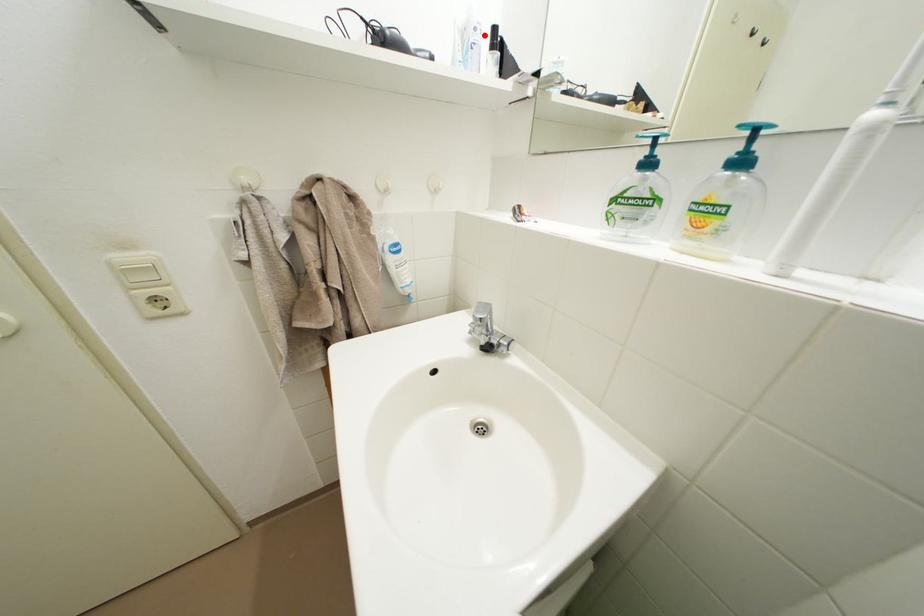
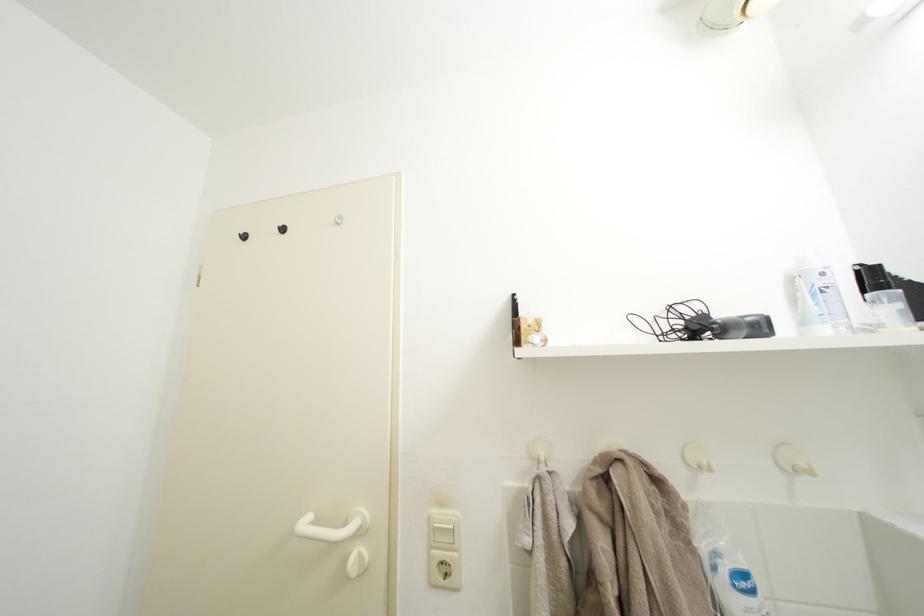
Find the pixel in the second image that matches the highlighted location in the first image.

(833, 280)